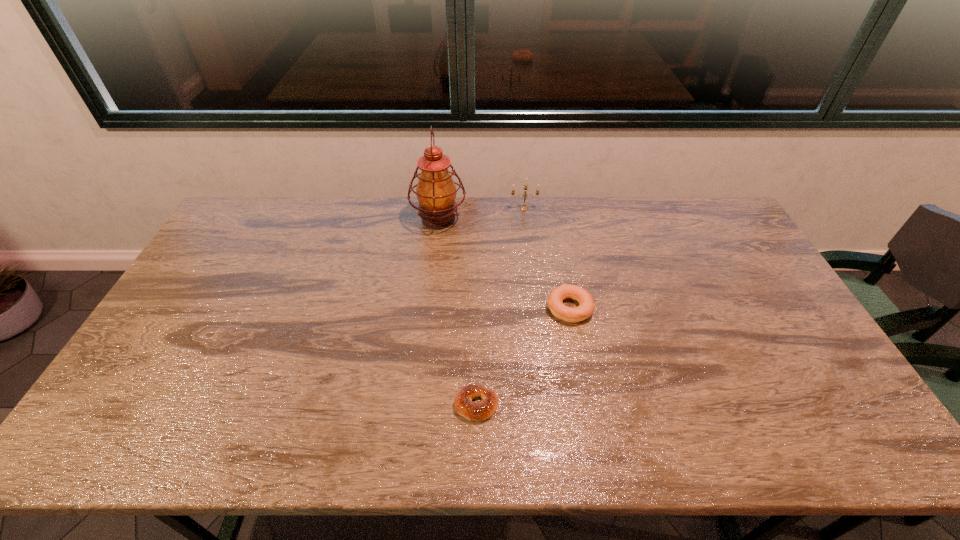
Locate an element on the screen. Image resolution: width=960 pixels, height=540 pixels. vacant space that satisfies the following two spatial constraints: 1. on the back side of the oil lamp; 2. on the right side of the candle is located at coordinates tap(440, 208).

You are a GUI agent. You are given a task and a screenshot of the screen. Output one action in this format:
    pyautogui.click(x=<x>, y=<y>)
    Task: Click on the free location that satisfies the following two spatial constraints: 1. on the back side of the candle; 2. on the right side of the oil lamp
    Image resolution: width=960 pixels, height=540 pixels.
    Given the screenshot: What is the action you would take?
    pyautogui.click(x=440, y=208)

Locate an element on the screen. This screenshot has width=960, height=540. vacant area that satisfies the following two spatial constraints: 1. on the front side of the farther bagel; 2. on the left side of the oil lamp is located at coordinates (429, 308).